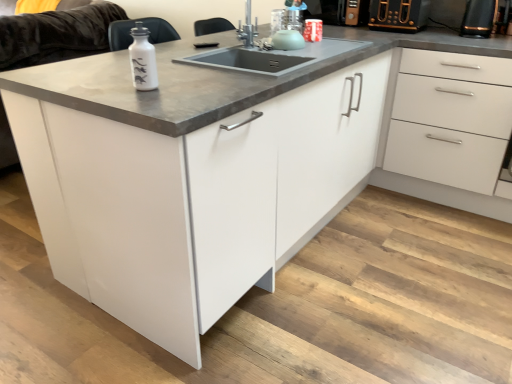
Question: Considering the relative sizes of white glossy drawer at right and white glossy cabinet at center in the image provided, is white glossy drawer at right shorter than white glossy cabinet at center?

Choices:
 (A) yes
 (B) no

Answer: (B)

Question: Does white glossy drawer at right have a lesser width compared to white glossy cabinet at center?

Choices:
 (A) yes
 (B) no

Answer: (A)

Question: Is white glossy drawer at right closer to camera compared to white glossy cabinet at center?

Choices:
 (A) no
 (B) yes

Answer: (A)

Question: From a real-world perspective, is white glossy drawer at right physically above white glossy cabinet at center?

Choices:
 (A) no
 (B) yes

Answer: (B)

Question: Can we say white glossy drawer at right lies outside white glossy cabinet at center?

Choices:
 (A) no
 (B) yes

Answer: (B)

Question: Is white glossy drawer at right to the right of white glossy cabinet at center from the viewer's perspective?

Choices:
 (A) no
 (B) yes

Answer: (B)

Question: Does white matte couch at upper left have a greater height compared to black plastic toaster at upper right, placed as the 1th appliance when sorted from left to right?

Choices:
 (A) no
 (B) yes

Answer: (B)

Question: From the image's perspective, is white matte couch at upper left below black plastic toaster at upper right, which appears as the 2th appliance when viewed from the right?

Choices:
 (A) no
 (B) yes

Answer: (B)

Question: Can we say white matte couch at upper left lies outside black plastic toaster at upper right, which appears as the 2th appliance when viewed from the right?

Choices:
 (A) yes
 (B) no

Answer: (A)

Question: Is white matte couch at upper left facing away from black plastic toaster at upper right, which appears as the 2th appliance when viewed from the right?

Choices:
 (A) no
 (B) yes

Answer: (B)

Question: From a real-world perspective, is white matte couch at upper left beneath black plastic toaster at upper right, placed as the 1th appliance when sorted from left to right?

Choices:
 (A) no
 (B) yes

Answer: (B)

Question: Can you confirm if white matte couch at upper left is thinner than black plastic toaster at upper right, which appears as the 2th appliance when viewed from the right?

Choices:
 (A) no
 (B) yes

Answer: (A)

Question: From the image's perspective, does white glossy bottle at upper left appear lower than white glossy drawer at right?

Choices:
 (A) no
 (B) yes

Answer: (B)